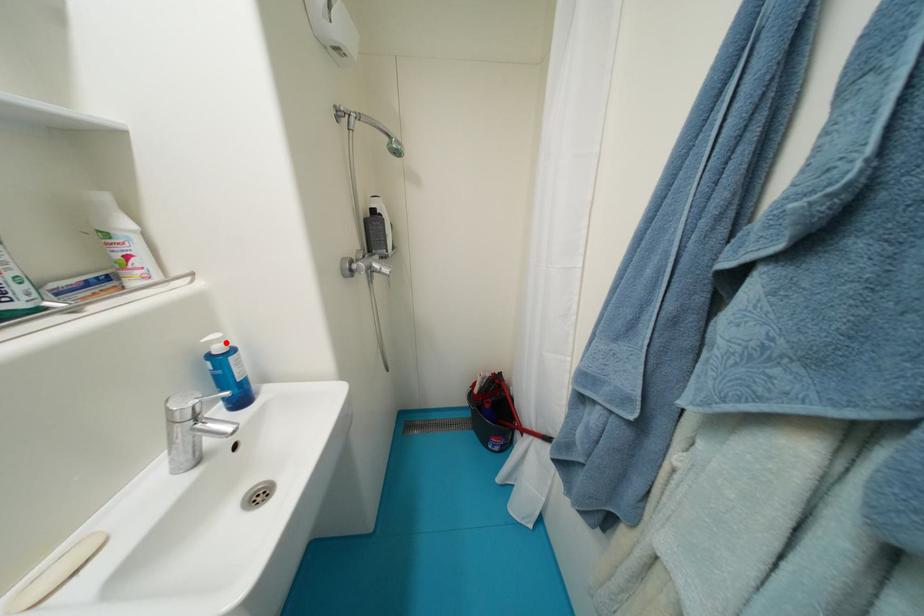
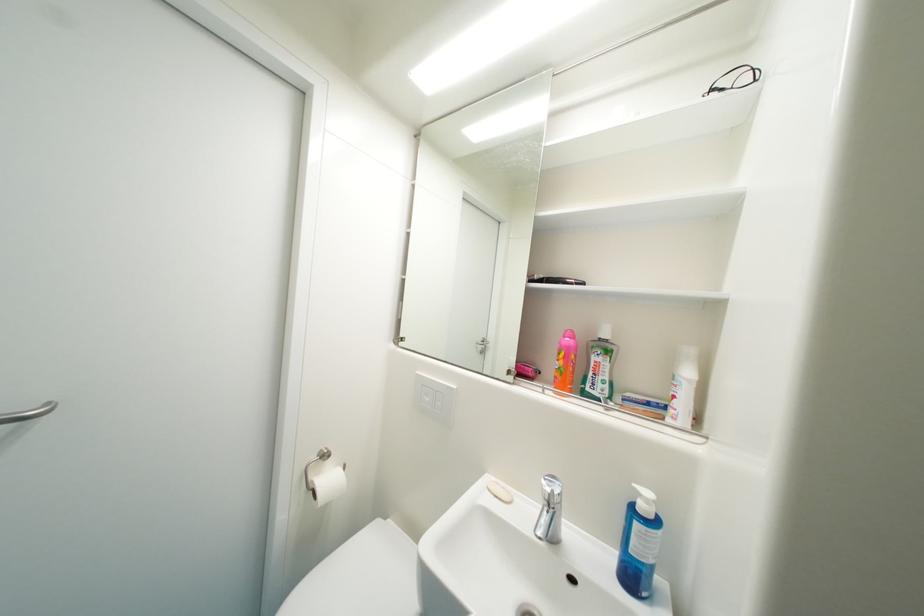
Locate, in the second image, the point that corresponds to the highlighted location in the first image.

(653, 503)